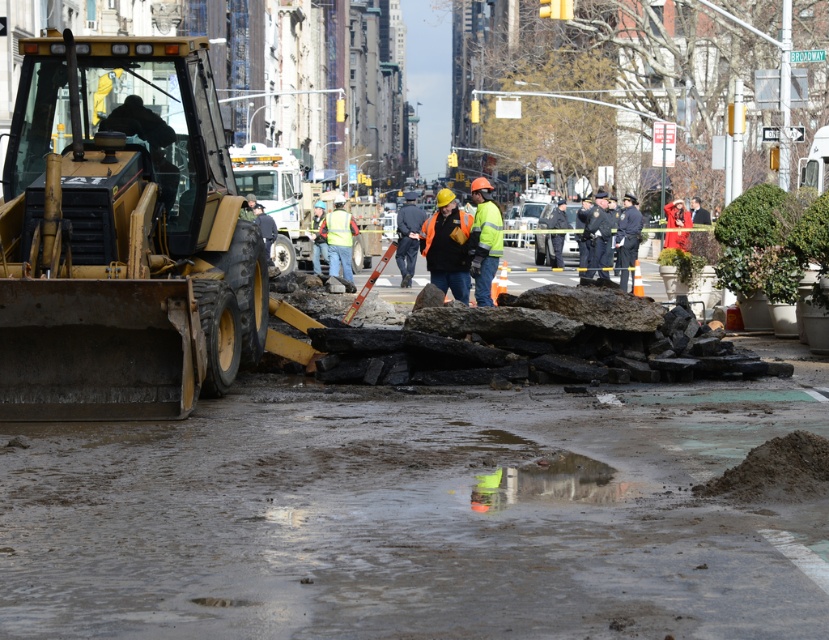
Can you confirm if yellow metallic excavator at left is bigger than orange reflective vest at center?

Incorrect, yellow metallic excavator at left is not larger than orange reflective vest at center.

Which is more to the right, yellow metallic excavator at left or orange reflective vest at center?

orange reflective vest at center

Identify the location of yellow metallic excavator at left. (122, 236).

Where is `yellow metallic excavator at left`? yellow metallic excavator at left is located at coordinates point(122,236).